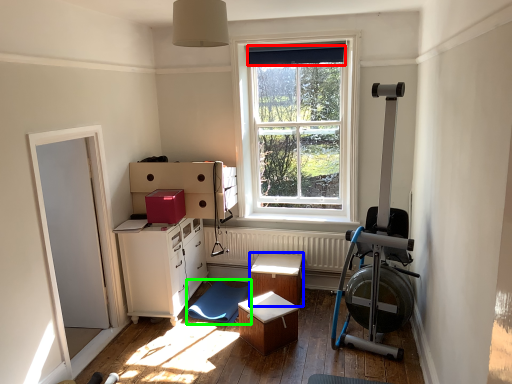
Question: Which object is the closest to the curtain (highlighted by a red box)? Choose among these: table (highlighted by a blue box) or swivel chair (highlighted by a green box).

Choices:
 (A) table
 (B) swivel chair

Answer: (A)